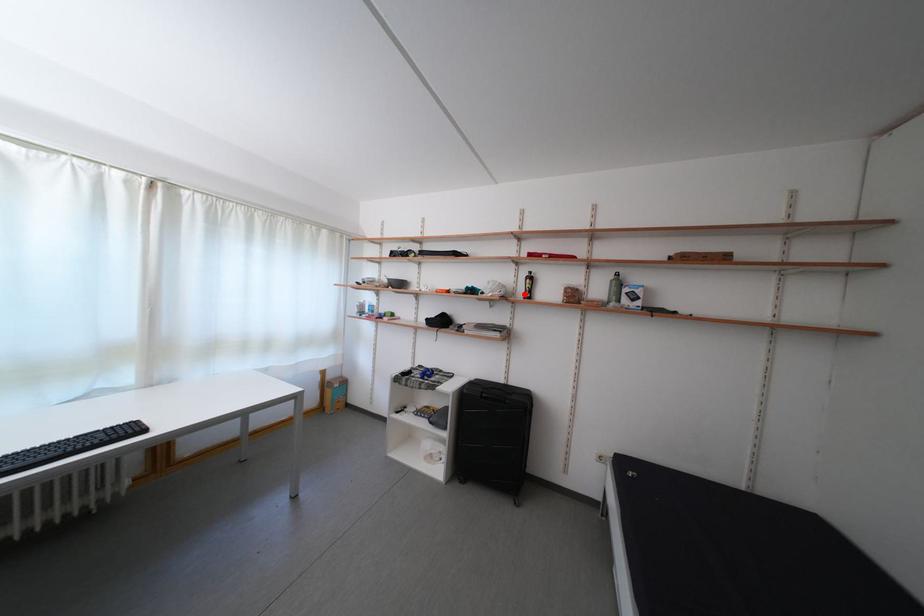
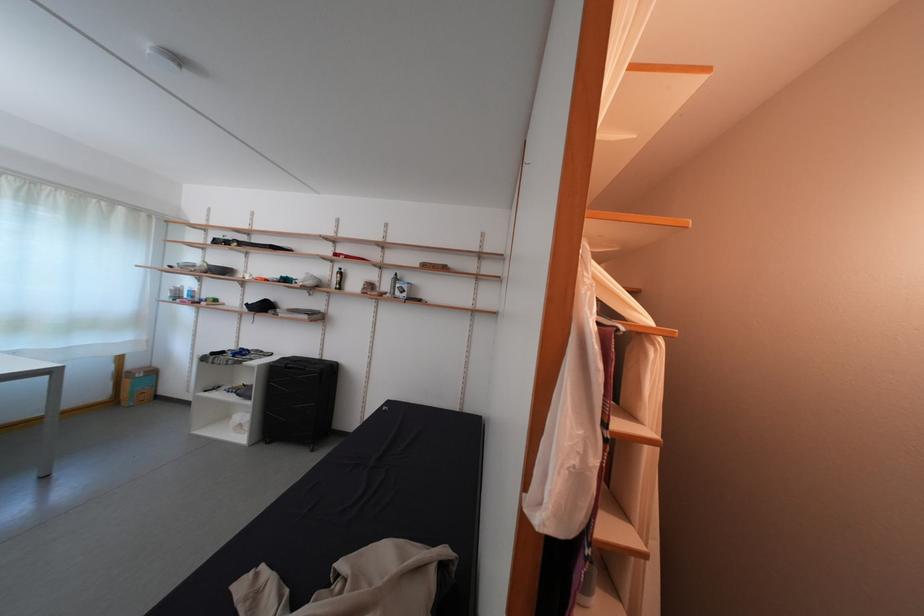
Find the pixel in the second image that matches the highlighted location in the first image.

(339, 286)